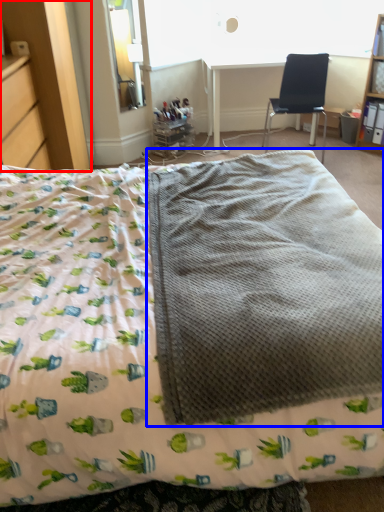
Question: Among these objects, which one is farthest to the camera, dresser (highlighted by a red box) or blanket (highlighted by a blue box)?

Choices:
 (A) dresser
 (B) blanket

Answer: (A)